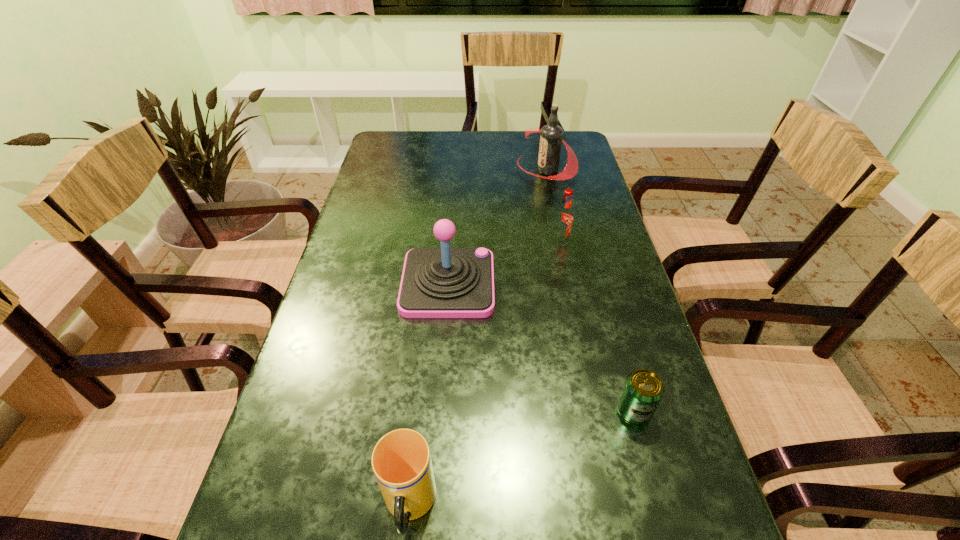
At what (x,y) coordinates should I click in order to perform the action: click on object that is the fourth nearest to the beer can. Please return your answer as a coordinate pair (x, y). This screenshot has width=960, height=540. Looking at the image, I should click on (551, 138).

The image size is (960, 540). Find the location of `vacant area in the image that satisfies the following two spatial constraints: 1. on the label of the beer can; 2. on the left side of the farthest object`. vacant area in the image that satisfies the following two spatial constraints: 1. on the label of the beer can; 2. on the left side of the farthest object is located at coordinates (597, 411).

This screenshot has width=960, height=540. Identify the location of vacant region that satisfies the following two spatial constraints: 1. forward from the base of the beer can; 2. on the left side of the third farthest object. (439, 411).

Where is `vacant region that satisfies the following two spatial constraints: 1. on the front side of the second nearest object; 2. on the right side of the nearer root beer`? Image resolution: width=960 pixels, height=540 pixels. vacant region that satisfies the following two spatial constraints: 1. on the front side of the second nearest object; 2. on the right side of the nearer root beer is located at coordinates (596, 411).

Locate an element on the screen. The width and height of the screenshot is (960, 540). free location that satisfies the following two spatial constraints: 1. on the front side of the nearer root beer; 2. forward from the base of the fourth shortest object is located at coordinates (570, 284).

Identify the location of free region that satisfies the following two spatial constraints: 1. on the label of the taller root beer; 2. on the front side of the second farthest object. This screenshot has width=960, height=540. click(562, 241).

I want to click on free spot that satisfies the following two spatial constraints: 1. on the label of the taller root beer; 2. on the back side of the shortest object, so click(597, 411).